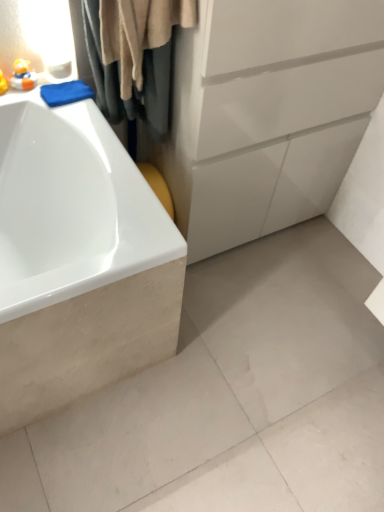
The width and height of the screenshot is (384, 512). In order to click on empty space that is ontop of white matte concrete at lower left (from a real-world perspective) in this screenshot , I will do `click(247, 366)`.